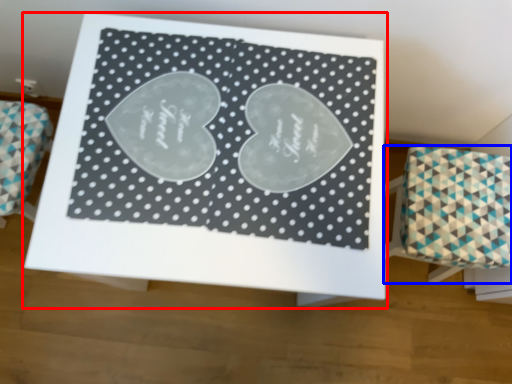
Question: Which object appears closest to the camera in this image, table (highlighted by a red box) or furniture (highlighted by a blue box)?

Choices:
 (A) table
 (B) furniture

Answer: (A)